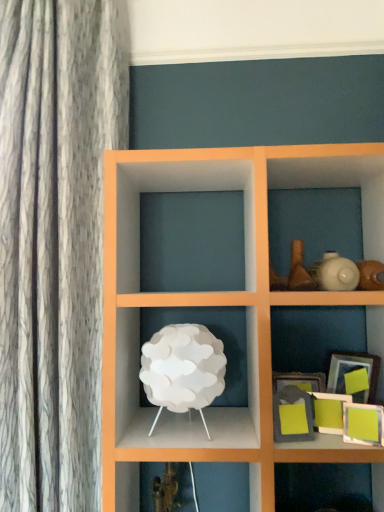
What is the approximate height of matte green picture frame at lower right, the 1th picture frame in the front-to-back sequence?

The height of matte green picture frame at lower right, the 1th picture frame in the front-to-back sequence, is 4.19 inches.

This screenshot has height=512, width=384. What do you see at coordinates (363, 424) in the screenshot?
I see `matte green picture frame at lower right, the 1th picture frame in the front-to-back sequence` at bounding box center [363, 424].

This screenshot has height=512, width=384. What do you see at coordinates (351, 371) in the screenshot?
I see `matte green picture frame at lower right, placed as the 4th picture frame when sorted from front to back` at bounding box center [351, 371].

At what (x,y) coordinates should I click in order to perform the action: click on matte gray picture frame at lower right, positioned as the fifth picture frame in front-to-back order. Please return your answer as a coordinate pair (x, y). Looking at the image, I should click on (299, 381).

Where is `white matte/porcelain table lamp at center`? The height and width of the screenshot is (512, 384). white matte/porcelain table lamp at center is located at coordinates (183, 369).

The width and height of the screenshot is (384, 512). What are the coordinates of `matte green picture frame at lower right, placed as the fifth picture frame when sorted from back to front` in the screenshot? It's located at (363, 424).

Where is `the 3rd picture frame to the left when counting from the matte green picture frame at lower right, the 1th picture frame in the front-to-back sequence`? the 3rd picture frame to the left when counting from the matte green picture frame at lower right, the 1th picture frame in the front-to-back sequence is located at coordinates (292, 415).

Considering the relative positions of matte green picture frame at lower right, the 1th picture frame in the front-to-back sequence, and matte gray picture frame at lower right, placed as the 2th picture frame when sorted from front to back, in the image provided, is matte green picture frame at lower right, the 1th picture frame in the front-to-back sequence, to the left of matte gray picture frame at lower right, placed as the 2th picture frame when sorted from front to back, from the viewer's perspective?

No.

From the image's perspective, between matte green picture frame at lower right, placed as the fifth picture frame when sorted from back to front, and matte gray picture frame at lower right, which is the fourth picture frame from back to front, which one is located above?

From the image's view, matte gray picture frame at lower right, which is the fourth picture frame from back to front, is above.

Could you tell me if matte green picture frame at lower right, the 1th picture frame in the front-to-back sequence, is facing matte gray picture frame at lower right, which is the fourth picture frame from back to front?

No.

Between matte green picture frame at lower right, placed as the 4th picture frame when sorted from front to back, and white matte/porcelain table lamp at center, which one has smaller size?

matte green picture frame at lower right, placed as the 4th picture frame when sorted from front to back.

Is white matte/porcelain table lamp at center located within matte green picture frame at lower right, marked as the second picture frame in a back-to-front arrangement?

No, white matte/porcelain table lamp at center is located outside of matte green picture frame at lower right, marked as the second picture frame in a back-to-front arrangement.

Considering the relative sizes of matte green picture frame at lower right, marked as the second picture frame in a back-to-front arrangement, and white matte/porcelain table lamp at center in the image provided, is matte green picture frame at lower right, marked as the second picture frame in a back-to-front arrangement, shorter than white matte/porcelain table lamp at center?

Indeed, matte green picture frame at lower right, marked as the second picture frame in a back-to-front arrangement, has a lesser height compared to white matte/porcelain table lamp at center.

Which object is wider, matte green picture frame at lower right, placed as the 4th picture frame when sorted from front to back, or white matte/porcelain table lamp at center?

Wider between the two is white matte/porcelain table lamp at center.

From the image's perspective, is matte green picture frame at lower right, placed as the fifth picture frame when sorted from back to front, over white matte/porcelain table lamp at center?

No, from the image's perspective, matte green picture frame at lower right, placed as the fifth picture frame when sorted from back to front, is not above white matte/porcelain table lamp at center.

Between matte green picture frame at lower right, the 1th picture frame in the front-to-back sequence, and white matte/porcelain table lamp at center, which one has less height?

matte green picture frame at lower right, the 1th picture frame in the front-to-back sequence, is shorter.

Is matte green picture frame at lower right, placed as the fifth picture frame when sorted from back to front, situated inside white matte/porcelain table lamp at center or outside?

matte green picture frame at lower right, placed as the fifth picture frame when sorted from back to front, lies outside white matte/porcelain table lamp at center.

Is matte green picture frame at lower right, placed as the fifth picture frame when sorted from back to front, oriented away from white matte/porcelain table lamp at center?

That's not correct — matte green picture frame at lower right, placed as the fifth picture frame when sorted from back to front, is not looking away from white matte/porcelain table lamp at center.

Looking at this image, is matte gray picture frame at lower right, which is the fourth picture frame from back to front, inside the boundaries of matte green picture frame at lower right, marked as the second picture frame in a back-to-front arrangement, or outside?

matte gray picture frame at lower right, which is the fourth picture frame from back to front, lies outside matte green picture frame at lower right, marked as the second picture frame in a back-to-front arrangement.

Is matte gray picture frame at lower right, placed as the 2th picture frame when sorted from front to back, further to the viewer compared to matte green picture frame at lower right, placed as the 4th picture frame when sorted from front to back?

No, matte gray picture frame at lower right, placed as the 2th picture frame when sorted from front to back, is in front of matte green picture frame at lower right, placed as the 4th picture frame when sorted from front to back.

Visually, is matte gray picture frame at lower right, placed as the 2th picture frame when sorted from front to back, positioned to the left or to the right of matte green picture frame at lower right, marked as the second picture frame in a back-to-front arrangement?

matte gray picture frame at lower right, placed as the 2th picture frame when sorted from front to back, is to the left of matte green picture frame at lower right, marked as the second picture frame in a back-to-front arrangement.

Is white matte/porcelain table lamp at center completely or partially inside matte gray picture frame at lower right, positioned as the fifth picture frame in front-to-back order?

Actually, white matte/porcelain table lamp at center is outside matte gray picture frame at lower right, positioned as the fifth picture frame in front-to-back order.

Between matte gray picture frame at lower right, positioned as the fifth picture frame in front-to-back order, and white matte/porcelain table lamp at center, which one has smaller size?

With smaller size is matte gray picture frame at lower right, positioned as the fifth picture frame in front-to-back order.

Between matte gray picture frame at lower right, positioned as the fifth picture frame in front-to-back order, and white matte/porcelain table lamp at center, which one appears on the left side from the viewer's perspective?

Positioned to the left is white matte/porcelain table lamp at center.

Based on the photo, from a real-world perspective, is matte gray picture frame at lower right, positioned as the fifth picture frame in front-to-back order, located higher than white matte/porcelain table lamp at center?

Incorrect, from a real-world perspective, matte gray picture frame at lower right, positioned as the fifth picture frame in front-to-back order, is lower than white matte/porcelain table lamp at center.

Considering the sizes of objects matte gray picture frame at lower right, the first picture frame viewed from the back, and matte green picture frame at lower right, the 3th picture frame in the front-to-back sequence, in the image provided, who is thinner, matte gray picture frame at lower right, the first picture frame viewed from the back, or matte green picture frame at lower right, the 3th picture frame in the front-to-back sequence,?

matte green picture frame at lower right, the 3th picture frame in the front-to-back sequence, is thinner.

Is there a large distance between matte gray picture frame at lower right, positioned as the fifth picture frame in front-to-back order, and matte green picture frame at lower right, marked as the third picture frame in a back-to-front arrangement?

No, matte gray picture frame at lower right, positioned as the fifth picture frame in front-to-back order, is not far from matte green picture frame at lower right, marked as the third picture frame in a back-to-front arrangement.

Is matte gray picture frame at lower right, positioned as the fifth picture frame in front-to-back order, facing towards matte green picture frame at lower right, the 3th picture frame in the front-to-back sequence?

Yes, matte gray picture frame at lower right, positioned as the fifth picture frame in front-to-back order, is oriented towards matte green picture frame at lower right, the 3th picture frame in the front-to-back sequence.

Considering the relative sizes of matte gray picture frame at lower right, positioned as the fifth picture frame in front-to-back order, and matte green picture frame at lower right, the 3th picture frame in the front-to-back sequence, in the image provided, is matte gray picture frame at lower right, positioned as the fifth picture frame in front-to-back order, smaller than matte green picture frame at lower right, the 3th picture frame in the front-to-back sequence,?

Actually, matte gray picture frame at lower right, positioned as the fifth picture frame in front-to-back order, might be larger than matte green picture frame at lower right, the 3th picture frame in the front-to-back sequence.

Is point (158, 373) less distant than point (371, 372)?

Yes, point (158, 373) is in front of point (371, 372).

Could you tell me if white matte/porcelain table lamp at center is facing matte green picture frame at lower right, marked as the second picture frame in a back-to-front arrangement?

No, white matte/porcelain table lamp at center is not turned towards matte green picture frame at lower right, marked as the second picture frame in a back-to-front arrangement.

Between white matte/porcelain table lamp at center and matte green picture frame at lower right, marked as the second picture frame in a back-to-front arrangement, which one has more height?

white matte/porcelain table lamp at center.

Which object is more forward, white matte/porcelain table lamp at center or matte green picture frame at lower right, marked as the second picture frame in a back-to-front arrangement?

Positioned in front is white matte/porcelain table lamp at center.

Which picture frame is the 1st one when counting from the back of the matte green picture frame at lower right, placed as the fifth picture frame when sorted from back to front? Please provide its 2D coordinates.

[(292, 415)]

Identify the location of table lamp in front of the matte green picture frame at lower right, placed as the 4th picture frame when sorted from front to back. This screenshot has height=512, width=384. (183, 369).

Looking at this image, when comparing their distances from matte gray picture frame at lower right, positioned as the fifth picture frame in front-to-back order, does matte green picture frame at lower right, placed as the fifth picture frame when sorted from back to front, or matte green picture frame at lower right, marked as the second picture frame in a back-to-front arrangement, seem closer?

matte green picture frame at lower right, marked as the second picture frame in a back-to-front arrangement, is positioned closer to the anchor matte gray picture frame at lower right, positioned as the fifth picture frame in front-to-back order.

Based on the photo, considering their positions, is matte green picture frame at lower right, the 3th picture frame in the front-to-back sequence, positioned further to white matte/porcelain table lamp at center than matte green picture frame at lower right, placed as the fifth picture frame when sorted from back to front?

The object further to white matte/porcelain table lamp at center is matte green picture frame at lower right, placed as the fifth picture frame when sorted from back to front.

Looking at the image, which one is located closer to matte green picture frame at lower right, placed as the 4th picture frame when sorted from front to back, matte green picture frame at lower right, placed as the fifth picture frame when sorted from back to front, or matte gray picture frame at lower right, placed as the 2th picture frame when sorted from front to back?

Among the two, matte green picture frame at lower right, placed as the fifth picture frame when sorted from back to front, is located nearer to matte green picture frame at lower right, placed as the 4th picture frame when sorted from front to back.

Based on their spatial positions, is matte gray picture frame at lower right, positioned as the fifth picture frame in front-to-back order, or matte green picture frame at lower right, the 1th picture frame in the front-to-back sequence, further from white matte/porcelain table lamp at center?

Among the two, matte green picture frame at lower right, the 1th picture frame in the front-to-back sequence, is located further to white matte/porcelain table lamp at center.

Based on their spatial positions, is matte gray picture frame at lower right, which is the fourth picture frame from back to front, or matte green picture frame at lower right, placed as the fifth picture frame when sorted from back to front, closer to matte gray picture frame at lower right, positioned as the fifth picture frame in front-to-back order?

matte gray picture frame at lower right, which is the fourth picture frame from back to front, lies closer to matte gray picture frame at lower right, positioned as the fifth picture frame in front-to-back order, than the other object.

Considering their positions, is matte green picture frame at lower right, placed as the 4th picture frame when sorted from front to back, positioned closer to matte green picture frame at lower right, placed as the fifth picture frame when sorted from back to front, than white matte/porcelain table lamp at center?

matte green picture frame at lower right, placed as the 4th picture frame when sorted from front to back, is closer to matte green picture frame at lower right, placed as the fifth picture frame when sorted from back to front.

Estimate the real-world distances between objects in this image. Which object is closer to matte gray picture frame at lower right, placed as the 2th picture frame when sorted from front to back, matte green picture frame at lower right, the 1th picture frame in the front-to-back sequence, or white matte/porcelain table lamp at center?

Among the two, matte green picture frame at lower right, the 1th picture frame in the front-to-back sequence, is located nearer to matte gray picture frame at lower right, placed as the 2th picture frame when sorted from front to back.

Looking at the image, which one is located further to matte green picture frame at lower right, marked as the second picture frame in a back-to-front arrangement, matte green picture frame at lower right, the 3th picture frame in the front-to-back sequence, or matte gray picture frame at lower right, the first picture frame viewed from the back?

Among the two, matte green picture frame at lower right, the 3th picture frame in the front-to-back sequence, is located further to matte green picture frame at lower right, marked as the second picture frame in a back-to-front arrangement.

This screenshot has height=512, width=384. I want to click on picture frame positioned between matte green picture frame at lower right, marked as the third picture frame in a back-to-front arrangement, and matte gray picture frame at lower right, positioned as the fifth picture frame in front-to-back order, from near to far, so click(x=351, y=371).

Identify the location of picture frame between white matte/porcelain table lamp at center and matte gray picture frame at lower right, the first picture frame viewed from the back, from left to right. (292, 415).